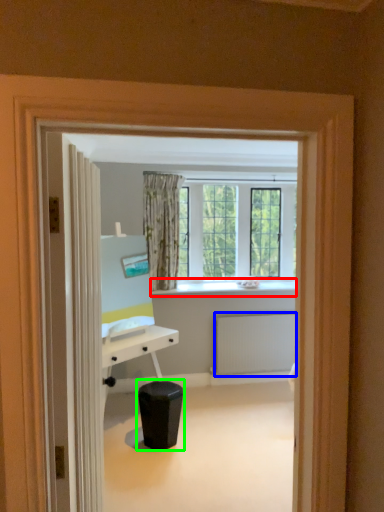
Question: Which object is positioned farthest from window sill (highlighted by a red box)? Select from radiator (highlighted by a blue box) and music stool (highlighted by a green box).

Choices:
 (A) radiator
 (B) music stool

Answer: (B)